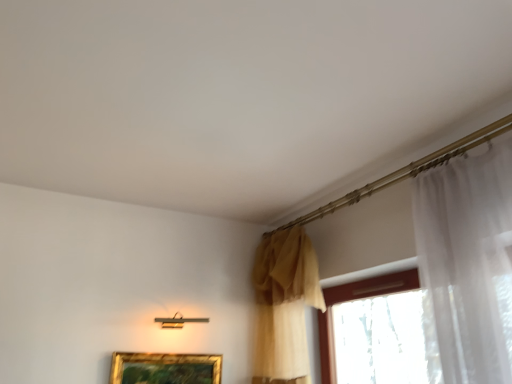
Question: From a real-world perspective, is matte yellow curtain at center over gold metallic picture frame at lower center?

Choices:
 (A) no
 (B) yes

Answer: (B)

Question: Can you confirm if matte yellow curtain at center is positioned to the left of gold metallic picture frame at lower center?

Choices:
 (A) yes
 (B) no

Answer: (B)

Question: Is matte yellow curtain at center further to camera compared to gold metallic picture frame at lower center?

Choices:
 (A) yes
 (B) no

Answer: (B)

Question: Is matte yellow curtain at center closer to camera compared to gold metallic picture frame at lower center?

Choices:
 (A) no
 (B) yes

Answer: (B)

Question: From a real-world perspective, is matte yellow curtain at center positioned under gold metallic picture frame at lower center based on gravity?

Choices:
 (A) yes
 (B) no

Answer: (B)

Question: Are matte yellow curtain at center and gold metallic picture frame at lower center making contact?

Choices:
 (A) no
 (B) yes

Answer: (A)

Question: Would you say gold metallic picture frame at lower center is outside matte yellow curtain at center?

Choices:
 (A) no
 (B) yes

Answer: (B)

Question: Can you confirm if gold metallic picture frame at lower center is thinner than matte yellow curtain at center?

Choices:
 (A) yes
 (B) no

Answer: (A)

Question: Can you confirm if gold metallic picture frame at lower center is smaller than matte yellow curtain at center?

Choices:
 (A) no
 (B) yes

Answer: (B)

Question: Can you see gold metallic picture frame at lower center touching matte yellow curtain at center?

Choices:
 (A) yes
 (B) no

Answer: (B)

Question: Is gold metallic picture frame at lower center taller than matte yellow curtain at center?

Choices:
 (A) no
 (B) yes

Answer: (A)

Question: Considering the relative sizes of gold metallic picture frame at lower center and matte yellow curtain at center in the image provided, is gold metallic picture frame at lower center shorter than matte yellow curtain at center?

Choices:
 (A) yes
 (B) no

Answer: (A)

Question: Based on their sizes in the image, would you say matte yellow curtain at center is bigger or smaller than gold metallic picture frame at lower center?

Choices:
 (A) big
 (B) small

Answer: (A)